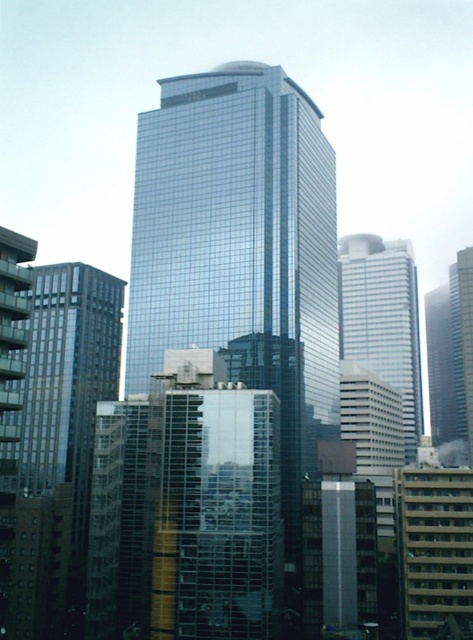
Question: Which is farther from the beige concrete building at lower right?

Choices:
 (A) white glass building at center
 (B) shiny glass skyscraper at center

Answer: (A)

Question: Which point appears farthest from the camera in this image?

Choices:
 (A) (421, 584)
 (B) (206, 227)
 (C) (362, 323)

Answer: (C)

Question: Which of the following is the farthest from the observer?

Choices:
 (A) (149, 292)
 (B) (359, 358)

Answer: (B)

Question: Does shiny glass skyscraper at center lie behind white glass building at center?

Choices:
 (A) yes
 (B) no

Answer: (B)

Question: Does shiny glass skyscraper at center have a greater width compared to beige concrete building at lower right?

Choices:
 (A) yes
 (B) no

Answer: (A)

Question: Does beige concrete building at lower right appear over white glass building at center?

Choices:
 (A) no
 (B) yes

Answer: (A)